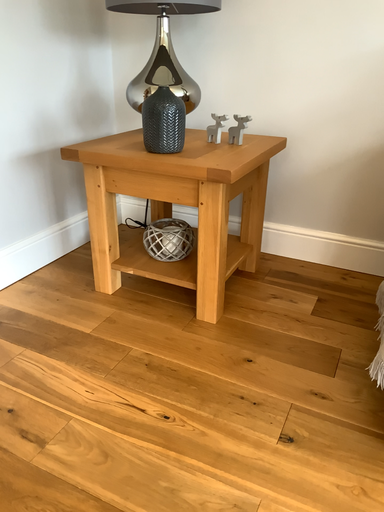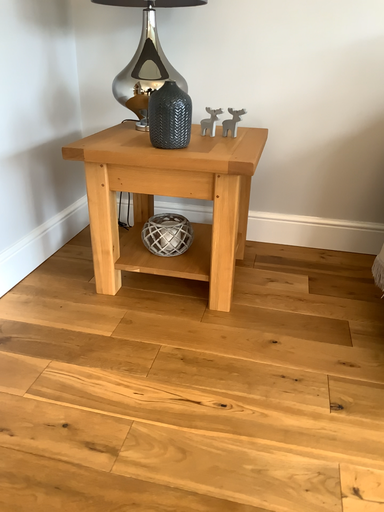
Question: How did the camera likely rotate when shooting the video?

Choices:
 (A) rotated left
 (B) rotated right

Answer: (B)